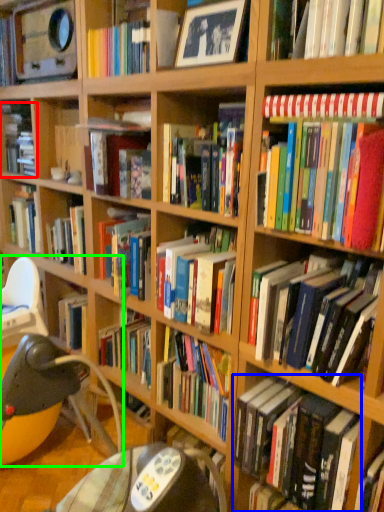
Question: Which object is positioned closest to book (highlighted by a red box)? Select from book (highlighted by a blue box) and bean bag chair (highlighted by a green box).

Choices:
 (A) book
 (B) bean bag chair

Answer: (B)